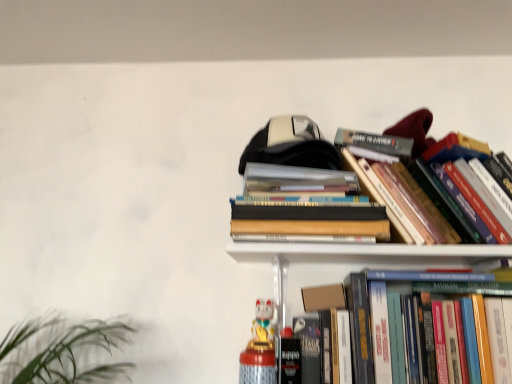
Question: Does white glossy cat figurine at lower center have a larger size compared to cardboard box at upper center?

Choices:
 (A) yes
 (B) no

Answer: (A)

Question: From a real-world perspective, is white glossy cat figurine at lower center below cardboard box at upper center?

Choices:
 (A) yes
 (B) no

Answer: (A)

Question: Is white glossy cat figurine at lower center not close to cardboard box at upper center?

Choices:
 (A) no
 (B) yes

Answer: (A)

Question: Is white glossy cat figurine at lower center beside cardboard box at upper center?

Choices:
 (A) yes
 (B) no

Answer: (B)

Question: Is cardboard box at upper center at the back of white glossy cat figurine at lower center?

Choices:
 (A) yes
 (B) no

Answer: (B)

Question: Based on their positions, is hardcover books at upper center, which is counted as the 2th book, starting from the top, located to the left or right of hardcover book at center right, the third book in the top-to-bottom sequence?

Choices:
 (A) left
 (B) right

Answer: (A)

Question: Is point (258, 178) positioned closer to the camera than point (471, 322)?

Choices:
 (A) farther
 (B) closer

Answer: (A)

Question: Is hardcover books at upper center, which is counted as the 2th book, starting from the top, wider or thinner than hardcover book at center right, the third book in the top-to-bottom sequence?

Choices:
 (A) wide
 (B) thin

Answer: (B)

Question: Is hardcover books at upper center, which is counted as the 2th book, starting from the top, in front of or behind hardcover book at center right, the third book in the top-to-bottom sequence, in the image?

Choices:
 (A) behind
 (B) front

Answer: (A)

Question: Choose the correct answer: Is hardcover book at center right, the third book in the top-to-bottom sequence, inside hardcover books at upper center, which is counted as the 2th book, starting from the top, or outside it?

Choices:
 (A) inside
 (B) outside

Answer: (B)

Question: Based on their positions, is hardcover book at center right, positioned as the 1th book in bottom-to-top order, located to the left or right of hardcover books at upper center, which is counted as the 2th book, starting from the top?

Choices:
 (A) left
 (B) right

Answer: (B)

Question: Does point (480, 299) appear closer or farther from the camera than point (381, 218)?

Choices:
 (A) farther
 (B) closer

Answer: (B)

Question: Is hardcover book at center right, the third book in the top-to-bottom sequence, wider or thinner than hardcover books at upper center, which is counted as the 2th book, starting from the top?

Choices:
 (A) thin
 (B) wide

Answer: (B)

Question: In terms of width, does white glossy cat figurine at lower center look wider or thinner when compared to hardcover book at center right, positioned as the 1th book in bottom-to-top order?

Choices:
 (A) wide
 (B) thin

Answer: (B)

Question: From the image's perspective, is white glossy cat figurine at lower center above or below hardcover book at center right, the third book in the top-to-bottom sequence?

Choices:
 (A) below
 (B) above

Answer: (A)